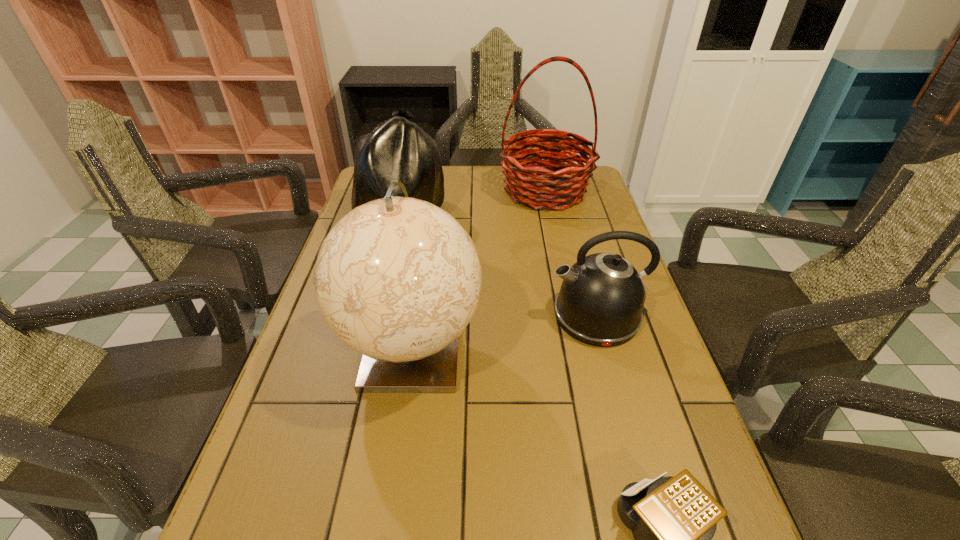
This screenshot has height=540, width=960. Identify the location of basket. (530, 185).

The width and height of the screenshot is (960, 540). Identify the location of globe. (397, 279).

Find the location of a particular element. the third tallest object is located at coordinates (398, 150).

Identify the location of kettle. (601, 299).

Locate an element on the screen. blank space located on the handle side of the basket is located at coordinates (557, 246).

The image size is (960, 540). What are the coordinates of `free spot located 0.170m on the surface of the globe showing Europe and Africa` in the screenshot? It's located at (389, 508).

Locate an element on the screen. This screenshot has width=960, height=540. free point located on the back of the plastic bag is located at coordinates (411, 175).

This screenshot has height=540, width=960. Find the location of `vacant region located 0.390m on the spout of the kettle`. vacant region located 0.390m on the spout of the kettle is located at coordinates (387, 315).

This screenshot has width=960, height=540. Identify the location of vacant space located 0.230m on the spout of the kettle. (453, 315).

Find the location of a particular element. vacant space located 0.310m on the spout of the kettle is located at coordinates (420, 315).